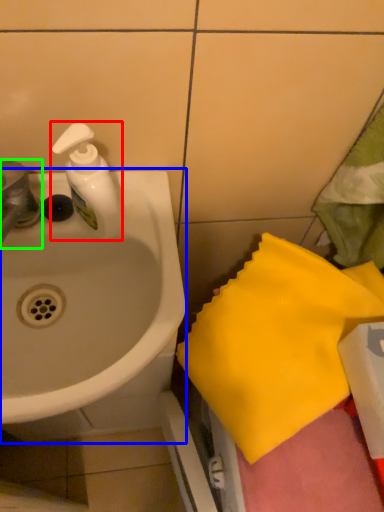
Question: Based on their relative distances, which object is nearer to soap dispenser (highlighted by a red box)? Choose from sink (highlighted by a blue box) and tap (highlighted by a green box).

Choices:
 (A) sink
 (B) tap

Answer: (B)